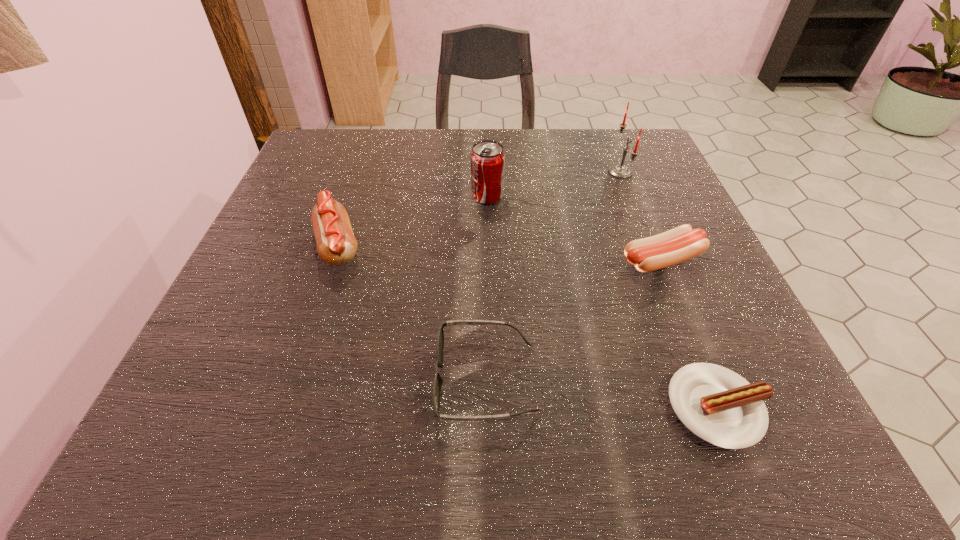
The height and width of the screenshot is (540, 960). I want to click on free space between the tallest sausage and the tallest object, so click(x=479, y=208).

Where is `object identified as the fourth closest to the tallest sausage`? The height and width of the screenshot is (540, 960). object identified as the fourth closest to the tallest sausage is located at coordinates (719, 406).

Locate an element on the screen. This screenshot has height=540, width=960. object that is the third closest to the sunglasses is located at coordinates (679, 244).

Where is `the second closest sausage to the second tallest sausage`? This screenshot has width=960, height=540. the second closest sausage to the second tallest sausage is located at coordinates (336, 244).

I want to click on sausage that can be found as the closest to the nearest sausage, so click(x=679, y=244).

At what (x,y) coordinates should I click in order to perform the action: click on vacant space that satisfies the following two spatial constraints: 1. on the back side of the shortest object; 2. on the front-facing side of the sunglasses. Please return your answer as a coordinate pair (x, y). Looking at the image, I should click on (707, 379).

I want to click on vacant point that satisfies the following two spatial constraints: 1. on the front-facing side of the shortest object; 2. on the right side of the tallest object, so click(714, 407).

At what (x,y) coordinates should I click in order to perform the action: click on free space that satisfies the following two spatial constraints: 1. on the front-facing side of the tallest object; 2. on the left side of the shortest sausage. Please return your answer as a coordinate pair (x, y). Looking at the image, I should click on (714, 407).